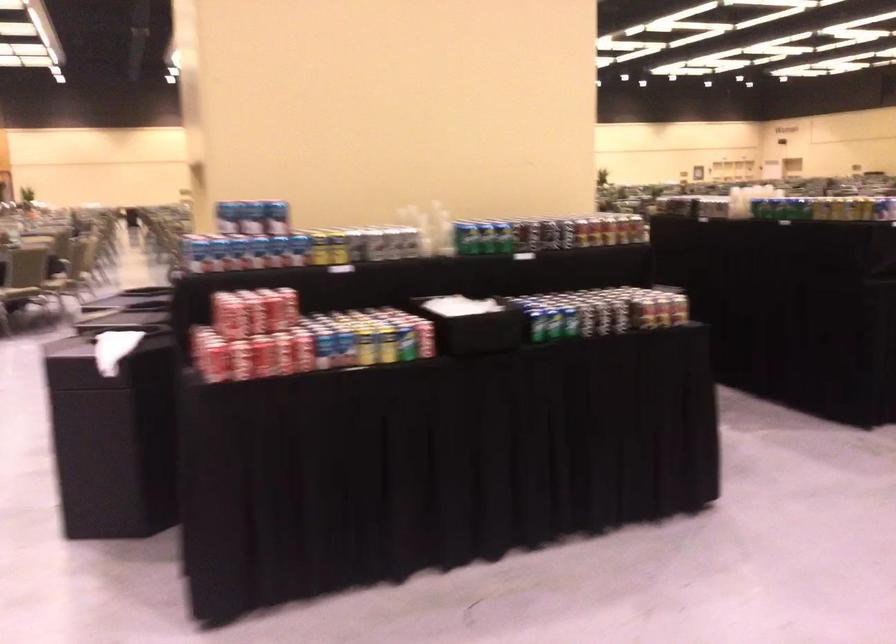
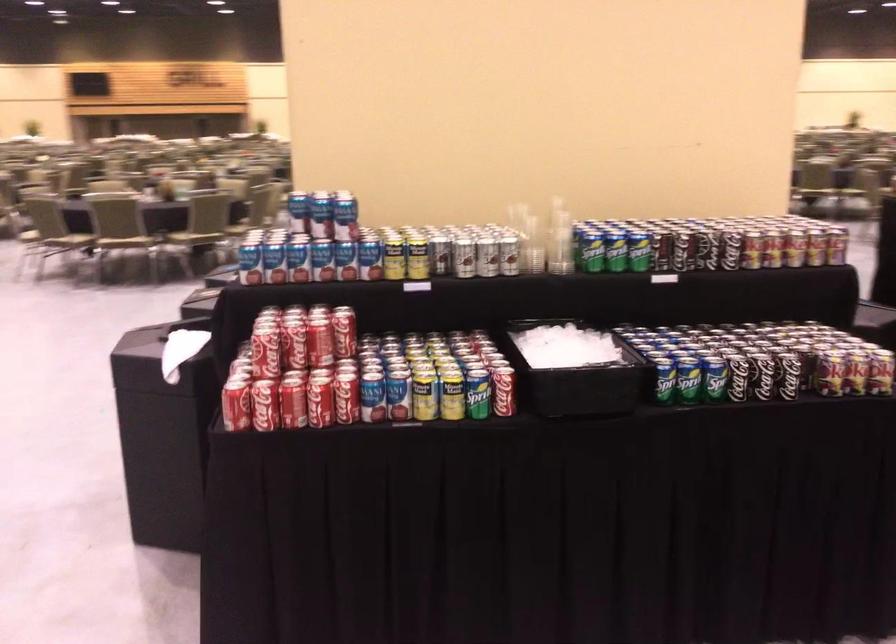
Question: How did the camera likely rotate?

Choices:
 (A) Left
 (B) Right
 (C) Up
 (D) Down

Answer: (A)